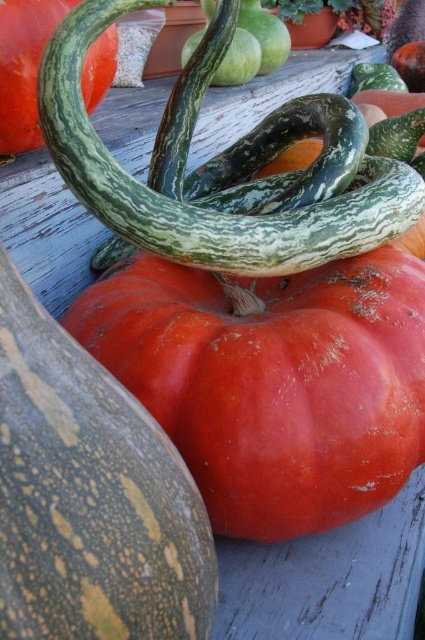
Which is behind, point (122, 497) or point (39, 22)?

The point (39, 22) is behind.

Can you confirm if smooth orange pumpkin at center is thinner than green striped gourd at center?

Yes.

Which is behind, point (2, 497) or point (105, 38)?

Positioned behind is point (105, 38).

Find the location of a particular element. Image resolution: width=425 pixels, height=640 pixels. smooth orange pumpkin at center is located at coordinates (90, 497).